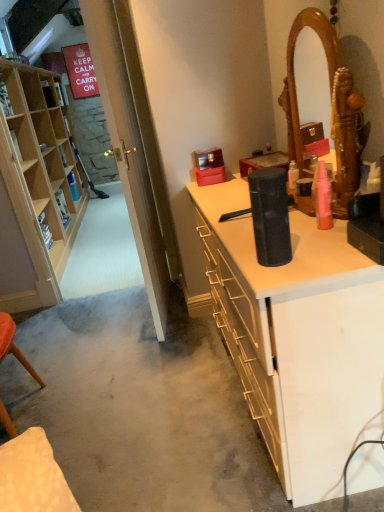
Image resolution: width=384 pixels, height=512 pixels. Identify the location of vacant area in front of pink matte spray can at upper right. (327, 248).